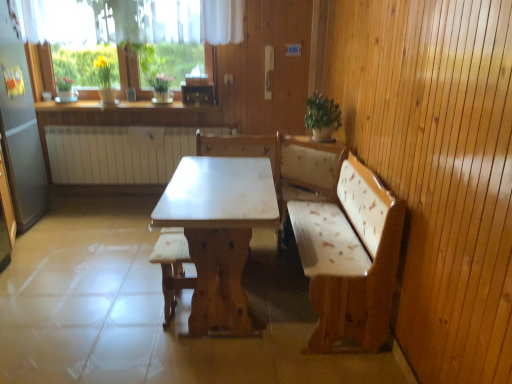
This screenshot has width=512, height=384. I want to click on vacant space in front of white fabric cushion at center, so click(x=167, y=344).